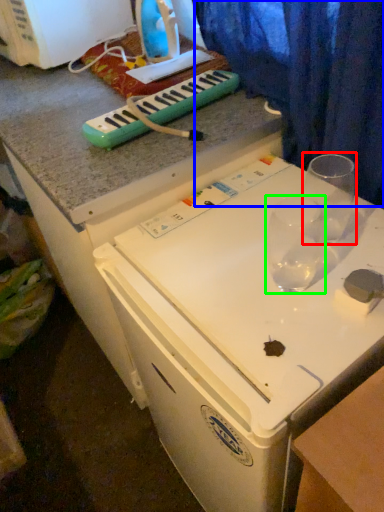
Question: Estimate the real-world distances between objects in this image. Which object is farther from martini glass (highlighted by a red box), curtain (highlighted by a blue box) or martini glass (highlighted by a green box)?

Choices:
 (A) curtain
 (B) martini glass

Answer: (A)